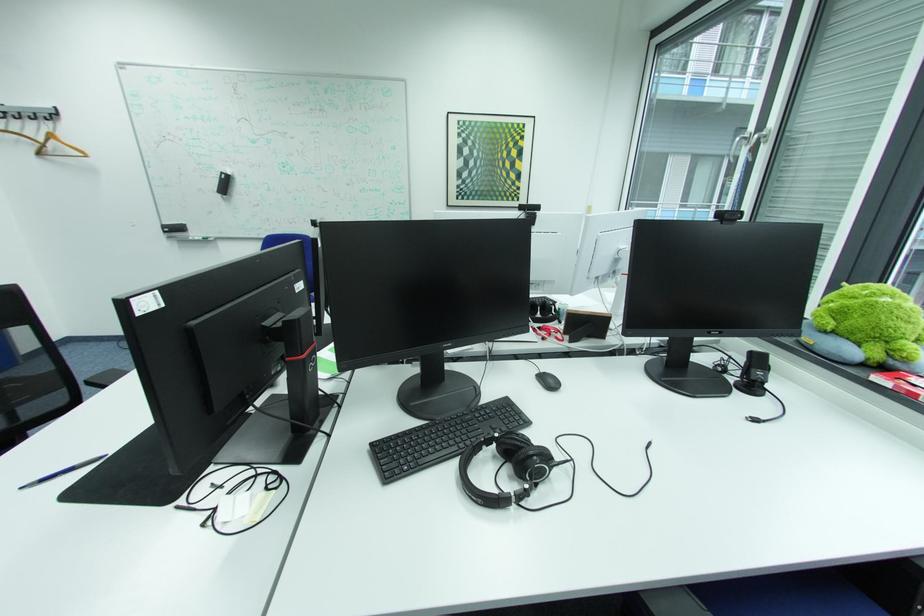
The width and height of the screenshot is (924, 616). What do you see at coordinates (767, 152) in the screenshot?
I see `a silver window handle` at bounding box center [767, 152].